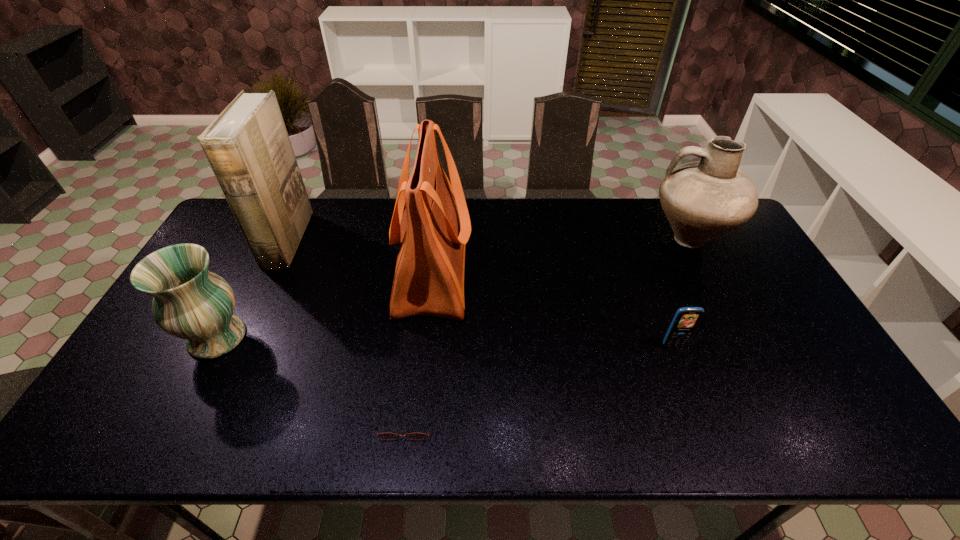
You are a GUI agent. You are given a task and a screenshot of the screen. Output one action in this format:
    pyautogui.click(x=<x>, y=<y>)
    Task: Click on the phonebook
    
    Given the screenshot: What is the action you would take?
    (247, 146)

This screenshot has height=540, width=960. I want to click on shopping bag, so click(x=433, y=231).

At what (x,y) coordinates should I click in order to perform the action: click on the rightmost object. Please return your answer as a coordinate pair (x, y). The height and width of the screenshot is (540, 960). Looking at the image, I should click on (702, 200).

Identify the location of pitcher. The width and height of the screenshot is (960, 540). (702, 200).

At what (x,y) coordinates should I click in order to perform the action: click on vase. Please return your answer as a coordinate pair (x, y). The width and height of the screenshot is (960, 540). Looking at the image, I should click on pos(190,302).

At what (x,y) coordinates should I click in order to perform the action: click on the second object from right to left. Please return your answer as a coordinate pair (x, y). Looking at the image, I should click on (686, 319).

At what (x,y) coordinates should I click in order to perform the action: click on the fifth tallest object. Please return your answer as a coordinate pair (x, y). The image size is (960, 540). Looking at the image, I should click on (686, 319).

Locate an element on the screen. The image size is (960, 540). sunglasses is located at coordinates (385, 436).

Find the location of a particular element. Image resolution: width=960 pixels, height=540 pixels. the shortest object is located at coordinates (385, 436).

At what (x,y) coordinates should I click in order to perform the action: click on free location located 0.130m on the cover of the phonebook. Please return your answer as a coordinate pair (x, y). The height and width of the screenshot is (540, 960). Looking at the image, I should click on (341, 241).